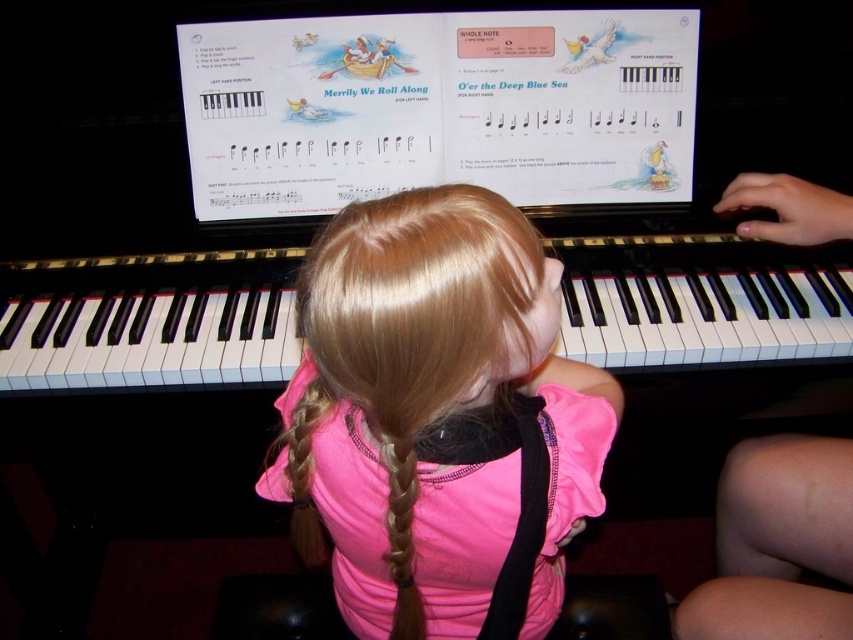
Question: Which point is closer to the camera?

Choices:
 (A) (24, 285)
 (B) (471, 419)
 (C) (405, 493)

Answer: (C)

Question: Can you confirm if pink fabric shirt at center is positioned above black polished piano at center?

Choices:
 (A) yes
 (B) no

Answer: (B)

Question: Which of the following is the closest to the observer?

Choices:
 (A) black polished piano at center
 (B) pink fabric shirt at center

Answer: (B)

Question: Is pink fabric shirt at center smaller than golden silky hair at center?

Choices:
 (A) no
 (B) yes

Answer: (A)

Question: Among these points, which one is nearest to the camera?

Choices:
 (A) (236, 321)
 (B) (502, 634)
 (C) (404, 561)

Answer: (C)

Question: Can you confirm if pink fabric shirt at center is positioned to the right of black polished piano at center?

Choices:
 (A) yes
 (B) no

Answer: (A)